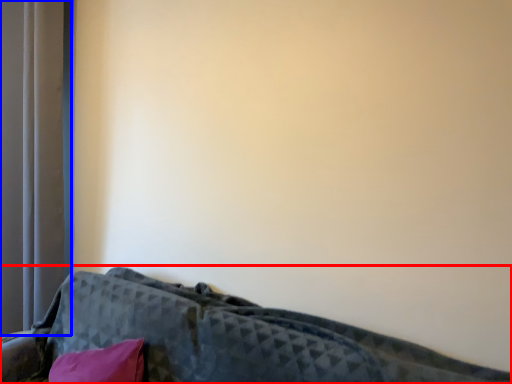
Question: Which object appears farthest to the camera in this image, furniture (highlighted by a red box) or curtain (highlighted by a blue box)?

Choices:
 (A) furniture
 (B) curtain

Answer: (B)